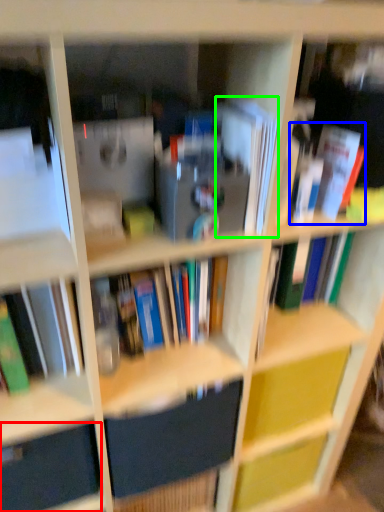
Question: Considering the real-world distances, which object is closest to drawer (highlighted by a red box)? book (highlighted by a blue box) or paperback book (highlighted by a green box).

Choices:
 (A) book
 (B) paperback book

Answer: (B)